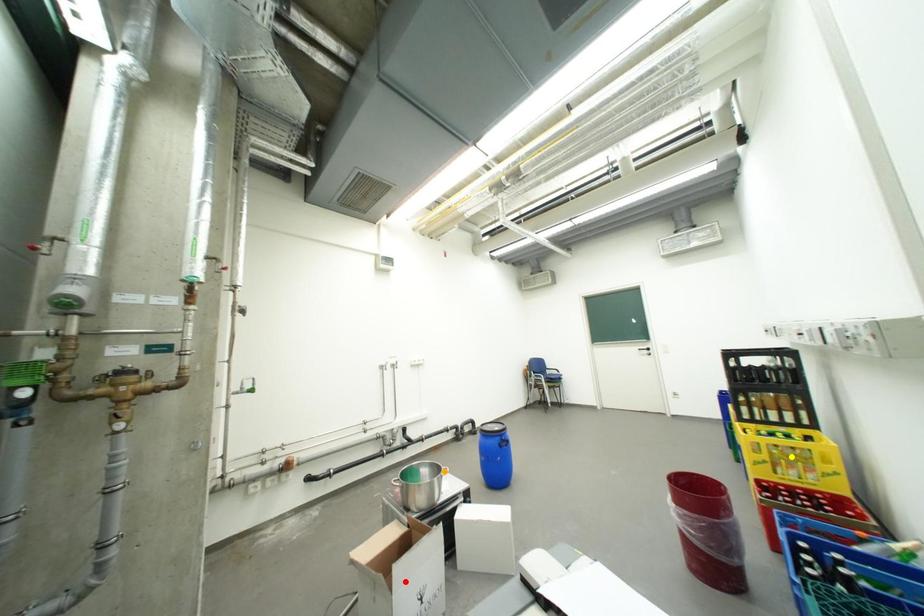
Order these from nearest to farthest:
1. yellow point
2. red point
3. orange point

red point
yellow point
orange point